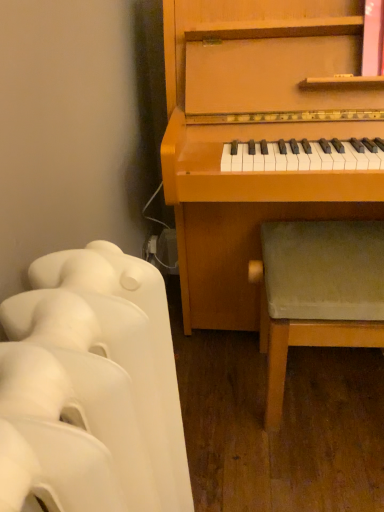
Question: Does green fabric stool at lower right have a larger size compared to white matte radiator at lower left?

Choices:
 (A) yes
 (B) no

Answer: (A)

Question: Does green fabric stool at lower right have a smaller size compared to white matte radiator at lower left?

Choices:
 (A) no
 (B) yes

Answer: (A)

Question: Is green fabric stool at lower right facing towards white matte radiator at lower left?

Choices:
 (A) yes
 (B) no

Answer: (B)

Question: From a real-world perspective, is green fabric stool at lower right beneath white matte radiator at lower left?

Choices:
 (A) no
 (B) yes

Answer: (B)

Question: Is green fabric stool at lower right to the left of white matte radiator at lower left from the viewer's perspective?

Choices:
 (A) yes
 (B) no

Answer: (B)

Question: From a real-world perspective, is green fabric stool at lower right located higher than white matte radiator at lower left?

Choices:
 (A) no
 (B) yes

Answer: (A)

Question: Considering the relative sizes of white matte radiator at lower left and green fabric stool at lower right in the image provided, is white matte radiator at lower left smaller than green fabric stool at lower right?

Choices:
 (A) yes
 (B) no

Answer: (A)

Question: Is green fabric stool at lower right inside white matte radiator at lower left?

Choices:
 (A) no
 (B) yes

Answer: (A)

Question: Is white matte radiator at lower left far away from green fabric stool at lower right?

Choices:
 (A) no
 (B) yes

Answer: (A)

Question: Could you tell me if white matte radiator at lower left is turned towards green fabric stool at lower right?

Choices:
 (A) no
 (B) yes

Answer: (A)

Question: From the image's perspective, does white matte radiator at lower left appear lower than green fabric stool at lower right?

Choices:
 (A) no
 (B) yes

Answer: (B)

Question: Does white matte radiator at lower left have a greater width compared to green fabric stool at lower right?

Choices:
 (A) yes
 (B) no

Answer: (B)

Question: From a real-world perspective, is white matte radiator at lower left physically located above or below green fabric stool at lower right?

Choices:
 (A) below
 (B) above

Answer: (B)